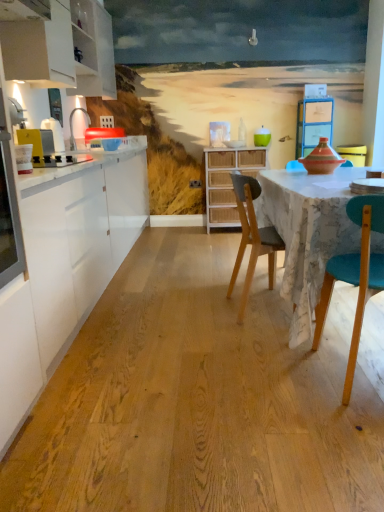
Question: Can you confirm if white glossy countertop at left is thinner than teal glossy bowl at upper center?

Choices:
 (A) yes
 (B) no

Answer: (B)

Question: From the image's perspective, does white glossy countertop at left appear higher than teal glossy bowl at upper center?

Choices:
 (A) yes
 (B) no

Answer: (B)

Question: Does white glossy countertop at left touch teal glossy bowl at upper center?

Choices:
 (A) yes
 (B) no

Answer: (B)

Question: From a real-world perspective, is white glossy countertop at left on teal glossy bowl at upper center?

Choices:
 (A) no
 (B) yes

Answer: (A)

Question: Does white glossy countertop at left appear on the left side of teal glossy bowl at upper center?

Choices:
 (A) no
 (B) yes

Answer: (B)

Question: Considering the positions of metallic silver toaster at left and teal glossy bowl at upper center in the image, is metallic silver toaster at left wider or thinner than teal glossy bowl at upper center?

Choices:
 (A) wide
 (B) thin

Answer: (A)

Question: From the image's perspective, is metallic silver toaster at left located above or below teal glossy bowl at upper center?

Choices:
 (A) above
 (B) below

Answer: (B)

Question: Is metallic silver toaster at left bigger or smaller than teal glossy bowl at upper center?

Choices:
 (A) small
 (B) big

Answer: (B)

Question: Is point (x=36, y=165) positioned closer to the camera than point (x=256, y=144)?

Choices:
 (A) farther
 (B) closer

Answer: (B)

Question: In terms of size, does white matte cabinet at upper left appear bigger or smaller than white glossy countertop at left?

Choices:
 (A) big
 (B) small

Answer: (B)

Question: Is white matte cabinet at upper left to the left or to the right of white glossy countertop at left in the image?

Choices:
 (A) right
 (B) left

Answer: (B)

Question: Considering the positions of point (87, 44) and point (76, 316), is point (87, 44) closer or farther from the camera than point (76, 316)?

Choices:
 (A) closer
 (B) farther

Answer: (B)

Question: Is white matte cabinet at upper left spatially inside white glossy countertop at left, or outside of it?

Choices:
 (A) inside
 (B) outside

Answer: (B)

Question: From a real-world perspective, relative to white glossy countertop at left, is wooden chair at center vertically above or below?

Choices:
 (A) above
 (B) below

Answer: (B)

Question: Would you say wooden chair at center is inside or outside white glossy countertop at left?

Choices:
 (A) inside
 (B) outside

Answer: (B)